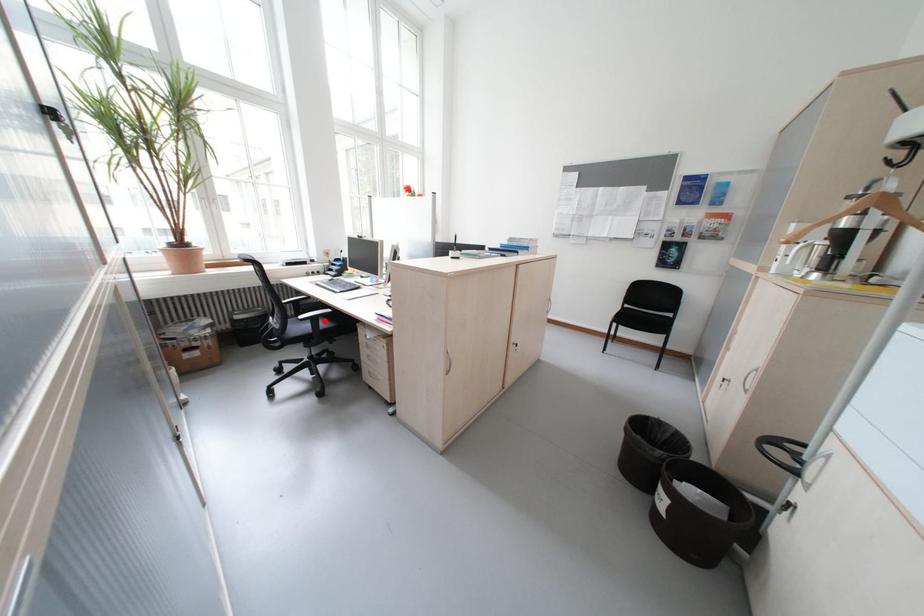
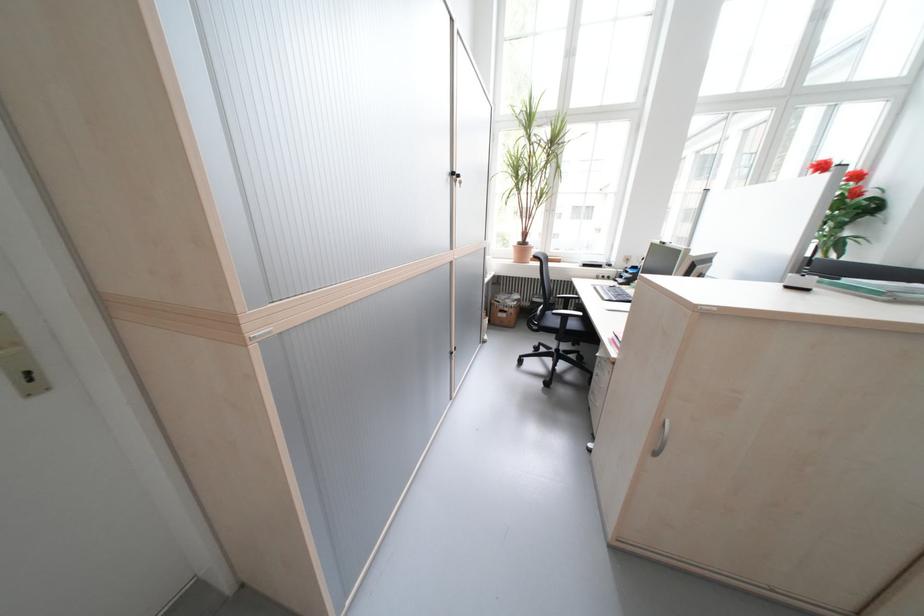
Question: I am providing you with two images of the same scene from different viewpoints. A red point is marked on the first image. At the location where the point appears in image 1, is it still visible in image 2?

Choices:
 (A) Yes
 (B) No

Answer: (A)